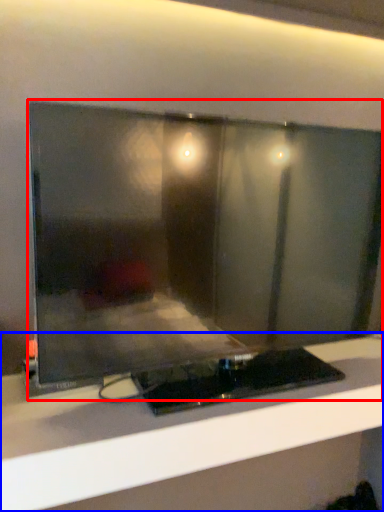
Question: Which of the following is the closest to the observer, computer monitor (highlighted by a red box) or furniture (highlighted by a blue box)?

Choices:
 (A) computer monitor
 (B) furniture

Answer: (A)